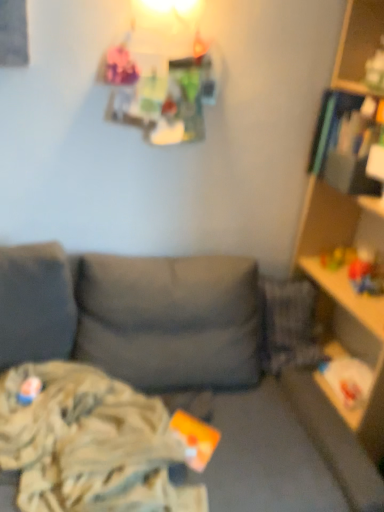
Question: Is rubberized yellow toy at right, the second toy positioned from the front, taller than matte plastic toy at lower left, which is counted as the 1th toy, starting from the bottom?

Choices:
 (A) no
 (B) yes

Answer: (A)

Question: Does rubberized yellow toy at right, which is counted as the first toy, starting from the right, contain matte plastic toy at lower left, the 1th toy positioned from the front?

Choices:
 (A) yes
 (B) no

Answer: (B)

Question: Is rubberized yellow toy at right, which is counted as the first toy, starting from the right, positioned far away from matte plastic toy at lower left, which is the first toy in left-to-right order?

Choices:
 (A) yes
 (B) no

Answer: (A)

Question: Is rubberized yellow toy at right, acting as the 1th toy starting from the top, next to matte plastic toy at lower left, which is counted as the 1th toy, starting from the bottom?

Choices:
 (A) no
 (B) yes

Answer: (A)

Question: From a real-world perspective, is rubberized yellow toy at right, acting as the 1th toy starting from the top, physically below matte plastic toy at lower left, which appears as the second toy when viewed from the back?

Choices:
 (A) no
 (B) yes

Answer: (A)

Question: Based on their positions, is wooden shelf at right located to the left or right of matte plastic toy at lower left, which is counted as the 1th toy, starting from the bottom?

Choices:
 (A) left
 (B) right

Answer: (B)

Question: From a real-world perspective, is wooden shelf at right physically located above or below matte plastic toy at lower left, the 1th toy positioned from the front?

Choices:
 (A) above
 (B) below

Answer: (A)

Question: Choose the correct answer: Is wooden shelf at right inside matte plastic toy at lower left, which is the first toy in left-to-right order, or outside it?

Choices:
 (A) inside
 (B) outside

Answer: (B)

Question: Is wooden shelf at right in front of or behind matte plastic toy at lower left, which is the first toy in left-to-right order, in the image?

Choices:
 (A) behind
 (B) front

Answer: (B)

Question: From a real-world perspective, is rubberized yellow toy at right, the first toy viewed from the back, physically located above or below matte plastic toy at lower left, acting as the second toy starting from the top?

Choices:
 (A) below
 (B) above

Answer: (B)

Question: In terms of size, does rubberized yellow toy at right, which is the second toy from left to right, appear bigger or smaller than matte plastic toy at lower left, placed as the second toy when sorted from right to left?

Choices:
 (A) small
 (B) big

Answer: (B)

Question: Considering the relative positions of rubberized yellow toy at right, which is the second toy from left to right, and matte plastic toy at lower left, which is counted as the 1th toy, starting from the bottom, in the image provided, is rubberized yellow toy at right, which is the second toy from left to right, to the left or to the right of matte plastic toy at lower left, which is counted as the 1th toy, starting from the bottom,?

Choices:
 (A) left
 (B) right

Answer: (B)

Question: Considering the positions of point (334, 252) and point (24, 395), is point (334, 252) closer or farther from the camera than point (24, 395)?

Choices:
 (A) farther
 (B) closer

Answer: (A)

Question: Would you say camouflage fabric blanket at lower left is to the left or to the right of rubberized yellow toy at right, which is the second toy from bottom to top, in the picture?

Choices:
 (A) right
 (B) left

Answer: (B)

Question: From a real-world perspective, is camouflage fabric blanket at lower left positioned above or below rubberized yellow toy at right, which is the second toy from left to right?

Choices:
 (A) below
 (B) above

Answer: (A)